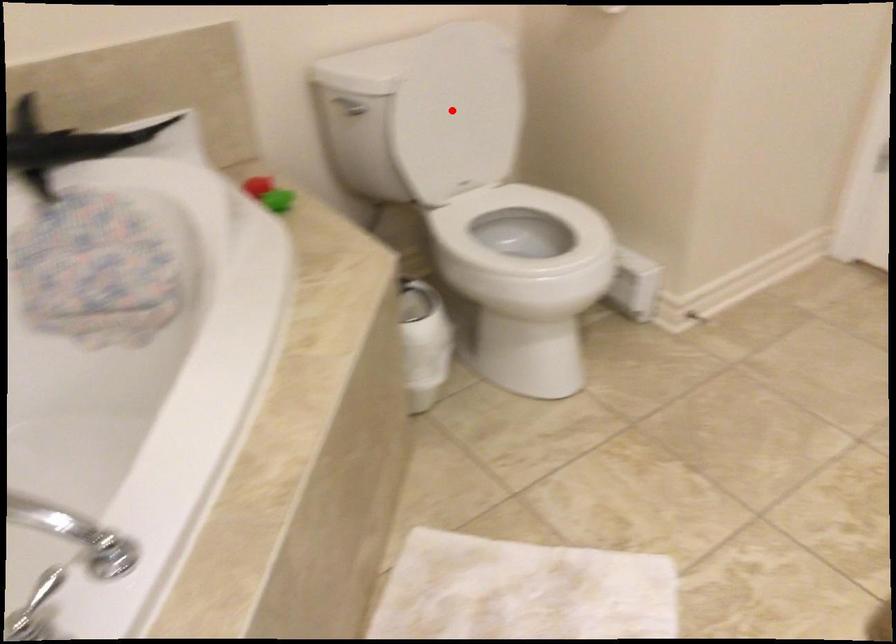
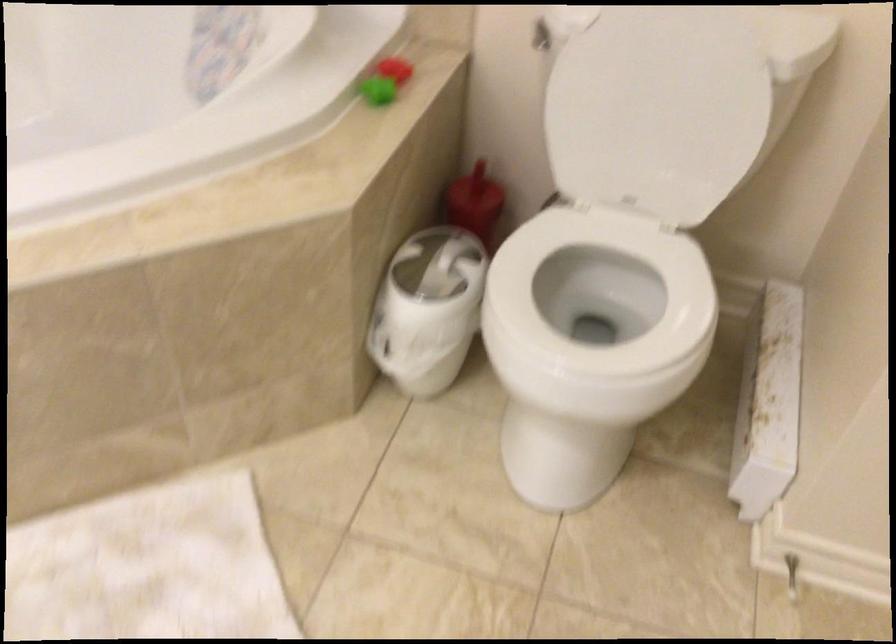
Question: I am providing you with two images of the same scene from different viewpoints. A red point is shown in image1. For the corresponding object point in image2, is it positioned nearer or farther from the camera?

Choices:
 (A) Nearer
 (B) Farther

Answer: (A)